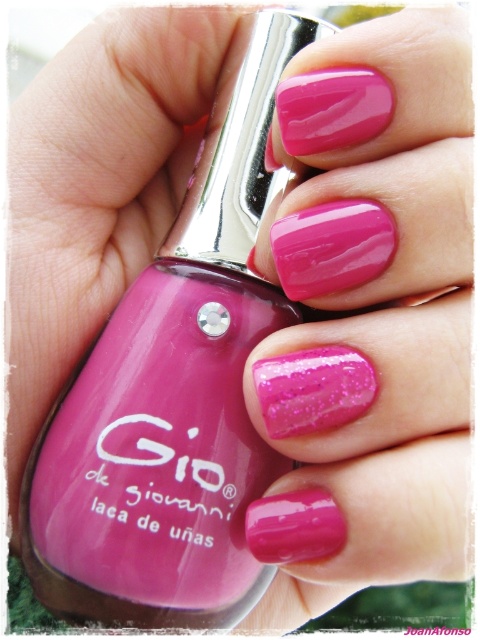
Question: Which of the following is the closest to the observer?

Choices:
 (A) (434, 326)
 (B) (240, 420)

Answer: (A)

Question: Does glossy pink nails at center appear on the right side of glossy pink nail polish at center?

Choices:
 (A) yes
 (B) no

Answer: (A)

Question: Observing the image, what is the correct spatial positioning of glossy pink nails at center in reference to glossy pink nail polish at center?

Choices:
 (A) left
 (B) right

Answer: (B)

Question: Which of the following is the farthest from the observer?

Choices:
 (A) glossy pink nails at center
 (B) glossy pink nail polish at center

Answer: (B)

Question: Does glossy pink nails at center appear under glossy pink nail polish at center?

Choices:
 (A) no
 (B) yes

Answer: (B)

Question: Which of the following is the closest to the observer?

Choices:
 (A) (196, 339)
 (B) (362, 88)

Answer: (B)